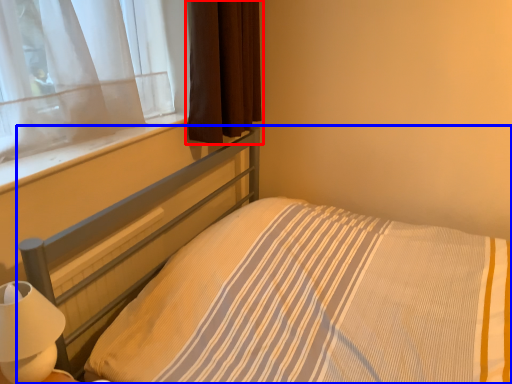
Question: Which of the following is the closest to the observer, curtain (highlighted by a red box) or bed (highlighted by a blue box)?

Choices:
 (A) curtain
 (B) bed

Answer: (B)